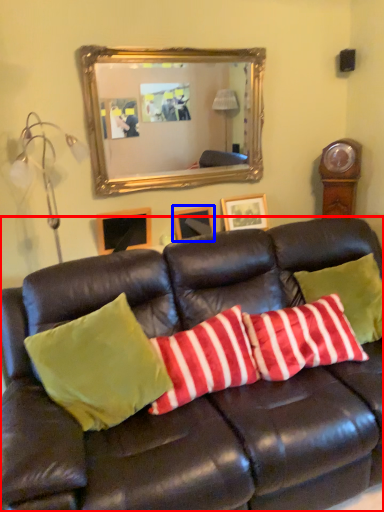
Question: Which of the following is the farthest to the observer, studio couch (highlighted by a red box) or picture frame (highlighted by a blue box)?

Choices:
 (A) studio couch
 (B) picture frame

Answer: (B)